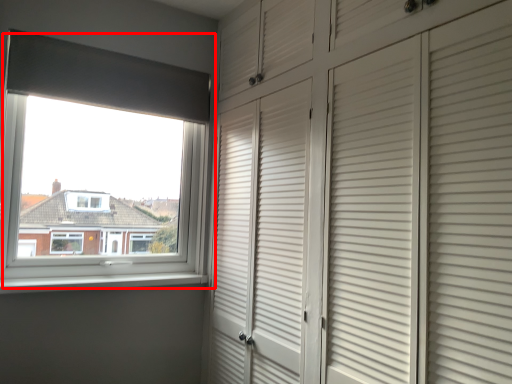
Question: From the image's perspective, what is the correct spatial positioning of window (annotated by the red box) in reference to window sill?

Choices:
 (A) above
 (B) below

Answer: (A)